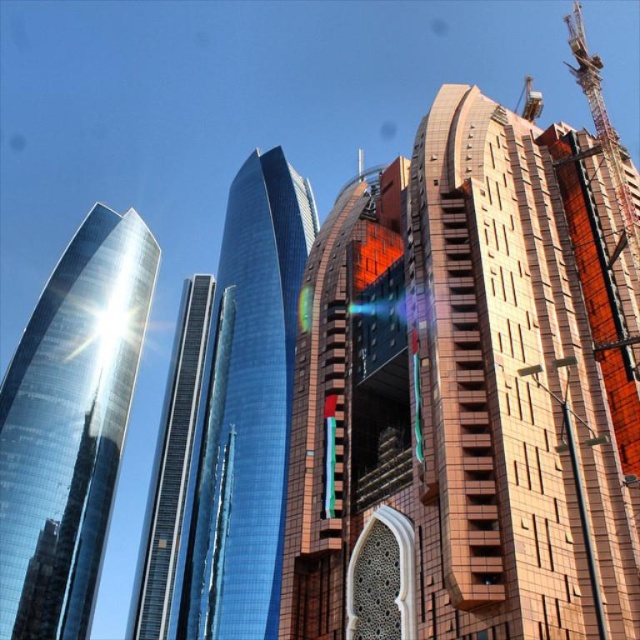
Can you confirm if shiny metallic skyscraper at left is positioned above orange brick building at center?

Actually, shiny metallic skyscraper at left is below orange brick building at center.

Is shiny metallic skyscraper at left taller than orange brick building at center?

Indeed, shiny metallic skyscraper at left has a greater height compared to orange brick building at center.

Which is in front, point (147, 304) or point (332, 451)?

Point (332, 451)

Identify the location of shiny metallic skyscraper at left. The width and height of the screenshot is (640, 640). (68, 426).

Does orange brick building at center appear under shiny glass skyscraper at center?

No, orange brick building at center is not below shiny glass skyscraper at center.

Is the position of orange brick building at center less distant than that of shiny glass skyscraper at center?

Yes, orange brick building at center is closer to the viewer.

This screenshot has width=640, height=640. I want to click on orange brick building at center, so click(x=332, y=396).

Is point (262, 244) positioned in front of point (358, 179)?

No, it is behind (358, 179).

Between point (232, 316) and point (316, 248), which one is positioned in front?

Point (316, 248) is more forward.

The image size is (640, 640). I want to click on glossy glass skyscraper at center, so click(244, 412).

Identify the location of glossy glass skyscraper at center. (244, 412).